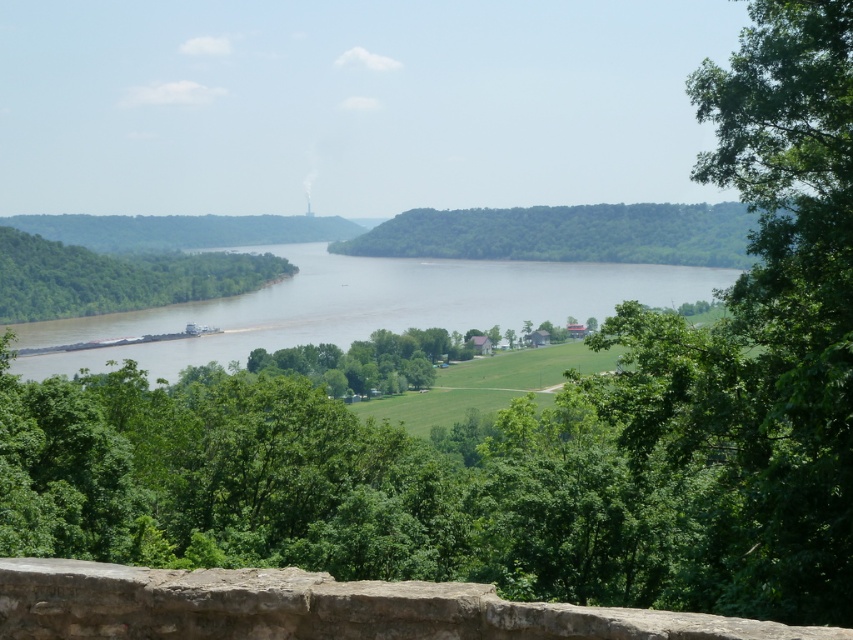
Between point (802, 632) and point (96, 259), which one is positioned in front?

Point (802, 632) is in front.

Consider the image. Does rustic stone ledge at lower center have a greater width compared to green leafy tree at left?

No, rustic stone ledge at lower center is not wider than green leafy tree at left.

Is point (239, 589) positioned after point (143, 278)?

No.

The height and width of the screenshot is (640, 853). Identify the location of rustic stone ledge at lower center. (318, 609).

Is brown matte river at center closer to camera compared to green leafy tree at left?

Yes.

From the picture: Who is positioned more to the left, brown matte river at center or green leafy tree at left?

Positioned to the left is green leafy tree at left.

Does point (578, 289) lie in front of point (106, 269)?

No, it is not.

Find the location of a particular element. brown matte river at center is located at coordinates (363, 305).

Based on the photo, does brown matte river at center appear on the left side of green leafy hill at center?

Indeed, brown matte river at center is positioned on the left side of green leafy hill at center.

Who is shorter, brown matte river at center or green leafy hill at center?

green leafy hill at center

Between point (721, 282) and point (695, 205), which one is positioned behind?

Point (695, 205)

Identify the location of brown matte river at center. (363, 305).